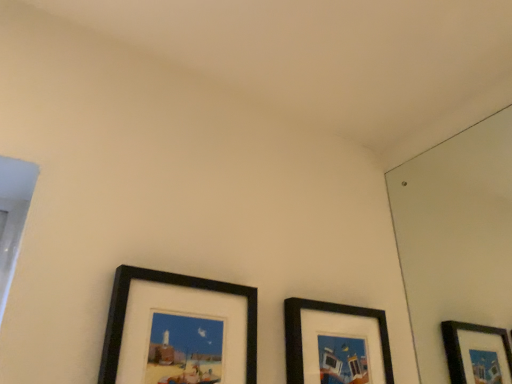
Question: Which direction should I rotate to look at black matte picture frame at center, arranged as the first picture frame when viewed from the right, — up or down?

Choices:
 (A) up
 (B) down

Answer: (B)

Question: Does black matte picture frame at lower left, the 1th picture frame in the left-to-right sequence, have a greater width compared to black matte picture frame at center, arranged as the first picture frame when viewed from the right?

Choices:
 (A) no
 (B) yes

Answer: (B)

Question: Is black matte picture frame at lower left, acting as the 2th picture frame starting from the right, touching black matte picture frame at center, arranged as the first picture frame when viewed from the right?

Choices:
 (A) yes
 (B) no

Answer: (B)

Question: Considering the relative sizes of black matte picture frame at lower left, acting as the 2th picture frame starting from the right, and black matte picture frame at center, arranged as the first picture frame when viewed from the right, in the image provided, is black matte picture frame at lower left, acting as the 2th picture frame starting from the right, bigger than black matte picture frame at center, arranged as the first picture frame when viewed from the right,?

Choices:
 (A) yes
 (B) no

Answer: (A)

Question: Can you confirm if black matte picture frame at lower left, acting as the 2th picture frame starting from the right, is thinner than black matte picture frame at center, the second picture frame in the left-to-right sequence?

Choices:
 (A) no
 (B) yes

Answer: (A)

Question: From a real-world perspective, is black matte picture frame at lower left, acting as the 2th picture frame starting from the right, positioned over black matte picture frame at center, the second picture frame in the left-to-right sequence, based on gravity?

Choices:
 (A) no
 (B) yes

Answer: (B)

Question: Does black matte picture frame at lower left, acting as the 2th picture frame starting from the right, have a lesser height compared to black matte picture frame at center, the second picture frame in the left-to-right sequence?

Choices:
 (A) no
 (B) yes

Answer: (A)

Question: Could you tell me if black matte picture frame at center, arranged as the first picture frame when viewed from the right, is facing black matte picture frame at lower left, acting as the 2th picture frame starting from the right?

Choices:
 (A) yes
 (B) no

Answer: (B)

Question: Is black matte picture frame at center, the second picture frame in the left-to-right sequence, facing away from black matte picture frame at lower left, acting as the 2th picture frame starting from the right?

Choices:
 (A) no
 (B) yes

Answer: (A)

Question: Does black matte picture frame at center, the second picture frame in the left-to-right sequence, lie behind black matte picture frame at lower left, the 1th picture frame in the left-to-right sequence?

Choices:
 (A) yes
 (B) no

Answer: (A)

Question: From the image's perspective, is black matte picture frame at center, the second picture frame in the left-to-right sequence, above black matte picture frame at lower left, acting as the 2th picture frame starting from the right?

Choices:
 (A) no
 (B) yes

Answer: (A)

Question: Does black matte picture frame at center, the second picture frame in the left-to-right sequence, have a greater height compared to black matte picture frame at lower left, acting as the 2th picture frame starting from the right?

Choices:
 (A) yes
 (B) no

Answer: (B)

Question: From the image's perspective, does black matte picture frame at center, arranged as the first picture frame when viewed from the right, appear lower than black matte picture frame at lower left, acting as the 2th picture frame starting from the right?

Choices:
 (A) no
 (B) yes

Answer: (B)

Question: Considering the positions of black matte picture frame at center, the second picture frame in the left-to-right sequence, and black matte picture frame at lower left, the 1th picture frame in the left-to-right sequence, in the image, is black matte picture frame at center, the second picture frame in the left-to-right sequence, wider or thinner than black matte picture frame at lower left, the 1th picture frame in the left-to-right sequence,?

Choices:
 (A) wide
 (B) thin

Answer: (B)